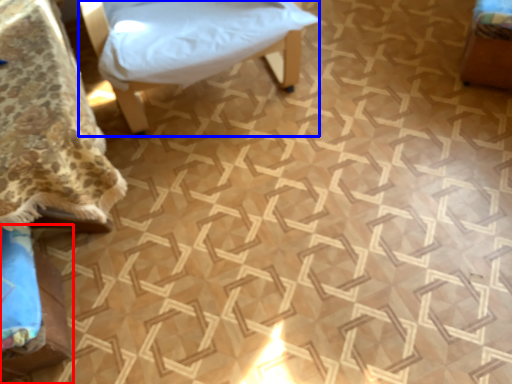
Question: Which object appears farthest to the camera in this image, furniture (highlighted by a red box) or furniture (highlighted by a blue box)?

Choices:
 (A) furniture
 (B) furniture

Answer: (B)